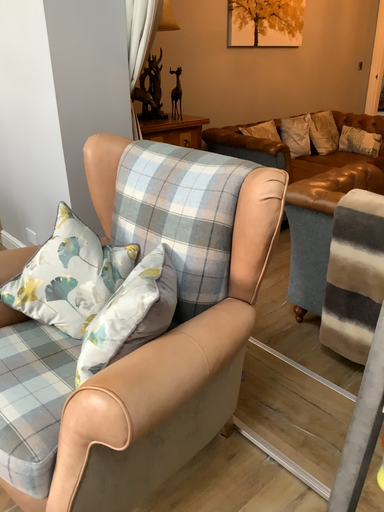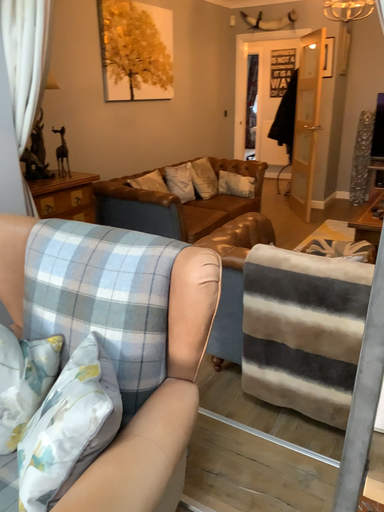
Question: How did the camera likely rotate when shooting the video?

Choices:
 (A) rotated left
 (B) rotated right

Answer: (B)